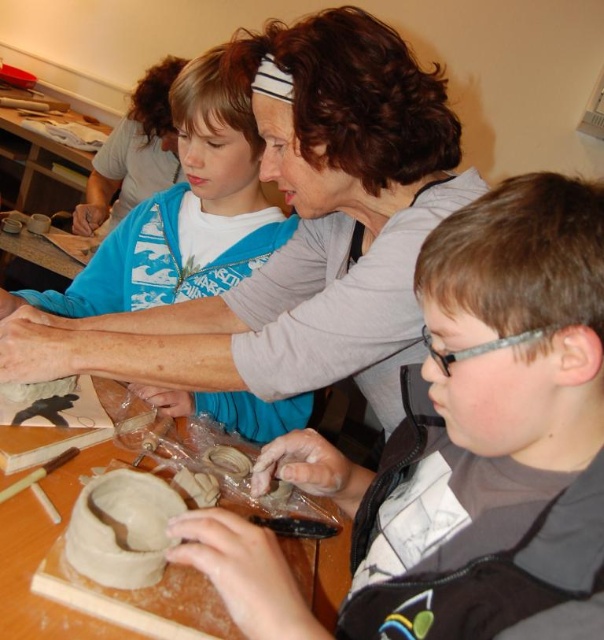
Who is positioned more to the left, matte gray clay at center or blue fabric shirt at upper center?

blue fabric shirt at upper center is more to the left.

Who is shorter, matte gray clay at center or blue fabric shirt at upper center?

matte gray clay at center is shorter.

Is point (443, 244) closer to camera compared to point (133, 276)?

Yes, point (443, 244) is in front of point (133, 276).

I want to click on matte gray clay at center, so click(x=483, y=429).